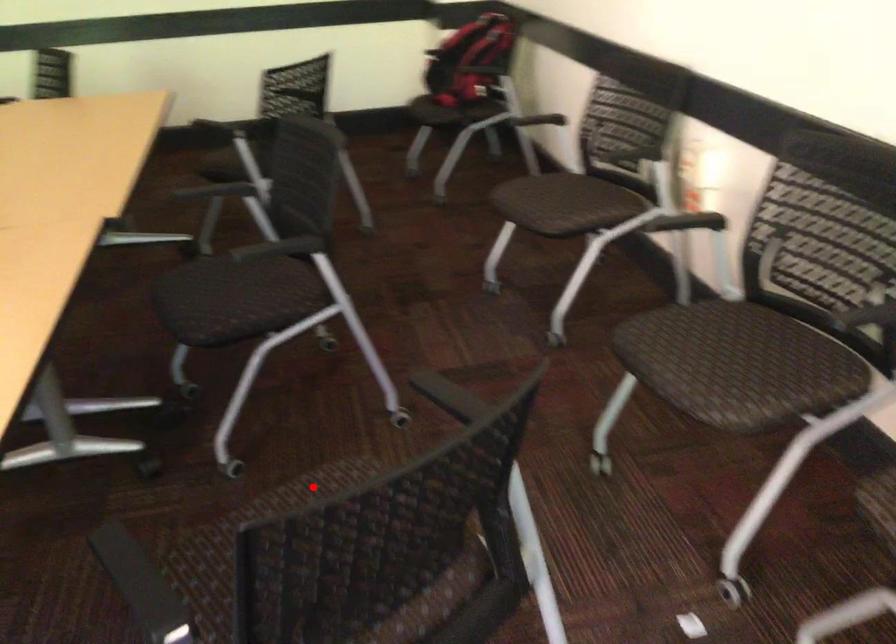
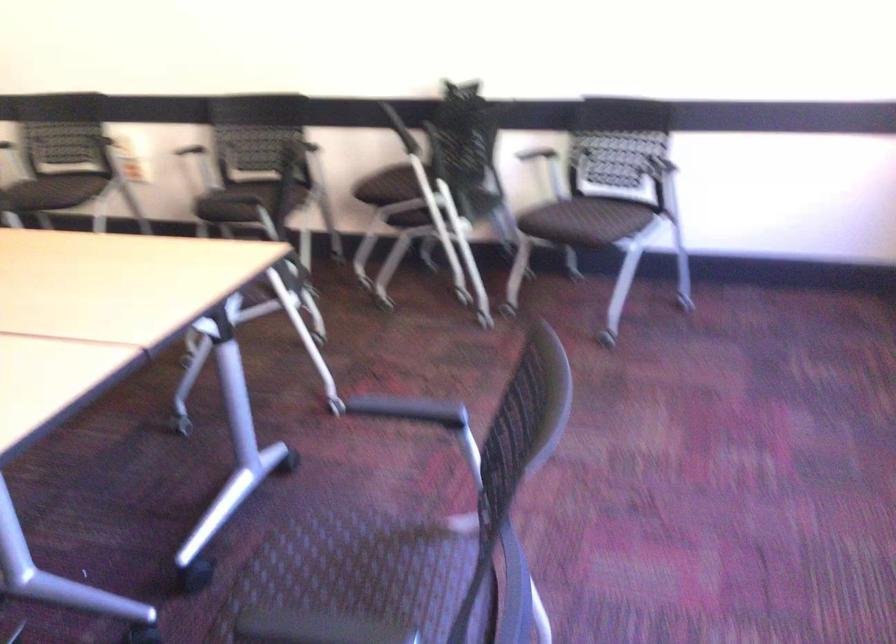
Question: I am providing you with two images of the same scene from different viewpoints. A red point is marked on the first image. Can you still see the location of the red point in image 2?

Choices:
 (A) Yes
 (B) No

Answer: (B)